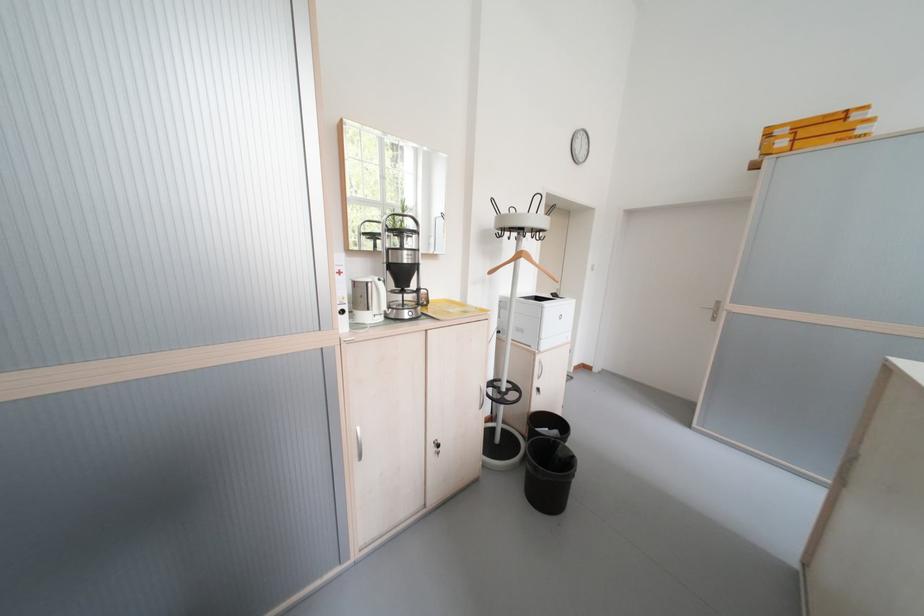
Where would you lift the yellow cardboard box? Please return your answer as a coordinate pair (x, y).

(817, 124)